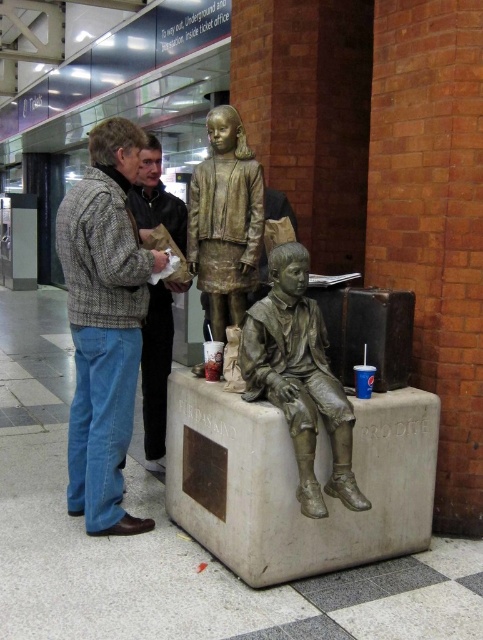
You are standing at the entrance of the train station and want to take a photo of the bronze statue of two children. The statue is located at point (116, 224). If your camera can focus on objects up to 10 feet away, will you be able to capture a clear photo of the statue?

The distance of point (116, 224) from the camera is 9.92 feet, which is within the camera focus range of up to 10 feet. Therefore, you can capture a clear photo of the bronze statue of two children.

You are standing in the train station and see two points marked in the scene. Which point is nearer to you, point (230,188) or point (164,352)?

Point (230,188) is closer to the viewer than point (164,352), so the first point is nearer to you.

You are a delivery person who needs to place a 55 cm wide package between the bronze statue at upper center and the light brown leather jacket at center. Can the package fit in the space between them?

The bronze statue at upper center and the light brown leather jacket at center are 56.12 centimeters apart. Since the package is 55 cm wide, it can fit in the space between them as the distance is slightly larger than the package width.